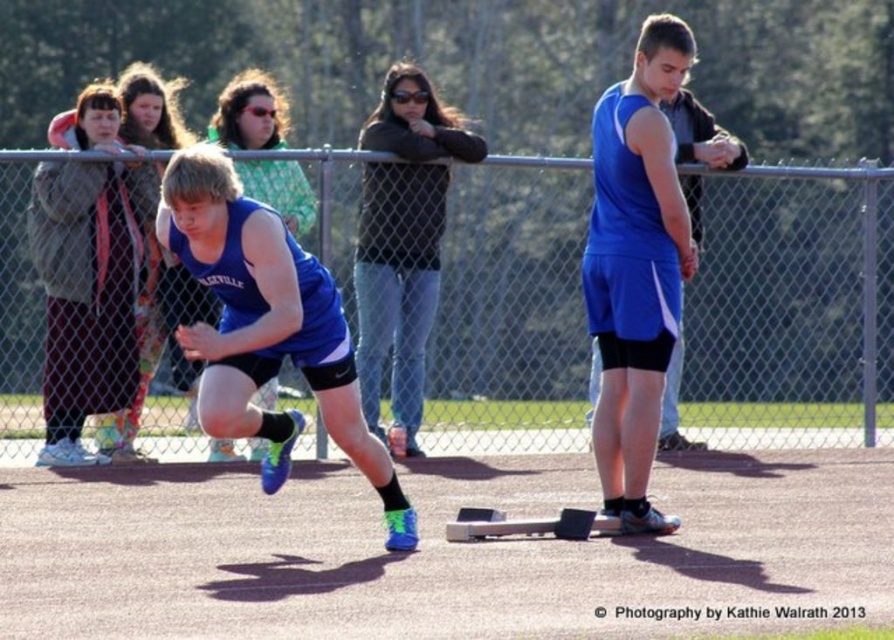
From the picture: You are a photographer positioned at the edge of the track. You need to capture a photo that includes both the blue matte tank top at center and the blue matte shorts at center. What is the minimum distance you should set your camera lens to ensure both objects are in frame?

The blue matte tank top at center is 7.34 feet away from the blue matte shorts at center. To capture both in the same frame, the camera lens should be set to a distance that can accommodate this separation, ensuring both are visible without cropping either object out.

Based on the scene description, can you determine if the blue matte tank top at center is wider than the blue matte shorts at center?

The blue matte tank top at center might be wider than blue matte shorts at center according to the description.